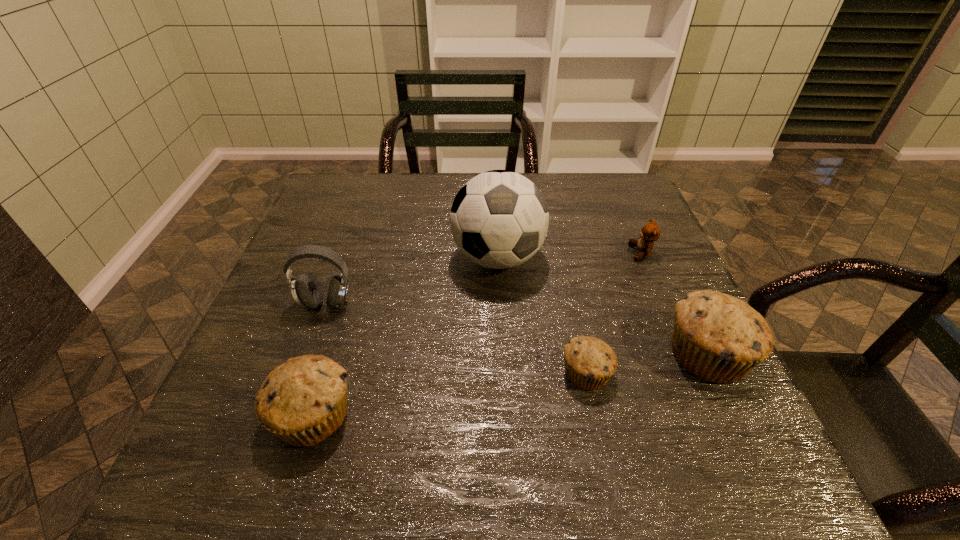
Identify the location of vacant point that satisfies the following two spatial constraints: 1. on the main logo of the rightmost muffin; 2. on the right side of the soccer ball. (502, 354).

I want to click on vacant space that satisfies the following two spatial constraints: 1. on the main logo of the second muffin from right to left; 2. on the right side of the soccer ball, so click(x=503, y=373).

Find the location of a particular element. This screenshot has height=540, width=960. vacant point that satisfies the following two spatial constraints: 1. on the ear cups of the third farthest object; 2. on the right side of the rightmost muffin is located at coordinates 308,354.

You are a GUI agent. You are given a task and a screenshot of the screen. Output one action in this format:
    pyautogui.click(x=<x>, y=<y>)
    Task: Click on the free space that satisfies the following two spatial constraints: 1. on the main logo of the rightmost muffin; 2. on the right side of the soccer ball
    The height and width of the screenshot is (540, 960).
    Given the screenshot: What is the action you would take?
    pyautogui.click(x=502, y=354)

Where is `free space that satisfies the following two spatial constraints: 1. on the front-facing side of the teddy bear; 2. on the front side of the second muffin from left to right`? The height and width of the screenshot is (540, 960). free space that satisfies the following two spatial constraints: 1. on the front-facing side of the teddy bear; 2. on the front side of the second muffin from left to right is located at coordinates (691, 373).

You are a GUI agent. You are given a task and a screenshot of the screen. Output one action in this format:
    pyautogui.click(x=<x>, y=<y>)
    Task: Click on the free location that satisfies the following two spatial constraints: 1. on the front-facing side of the teddy bear; 2. on the ear cups of the headset
    Image resolution: width=960 pixels, height=540 pixels.
    Given the screenshot: What is the action you would take?
    pyautogui.click(x=662, y=303)

Where is `vacant space that satisfies the following two spatial constraints: 1. on the back side of the second muffin from right to left; 2. on the left side of the rightmost muffin`? The width and height of the screenshot is (960, 540). vacant space that satisfies the following two spatial constraints: 1. on the back side of the second muffin from right to left; 2. on the left side of the rightmost muffin is located at coordinates (583, 354).

The width and height of the screenshot is (960, 540). Identify the location of free region that satisfies the following two spatial constraints: 1. on the ear cups of the third shortest object; 2. on the right side of the headset. (287, 415).

Find the location of a particular element. free space that satisfies the following two spatial constraints: 1. on the main logo of the shortest muffin; 2. on the right side of the tallest object is located at coordinates [503, 373].

You are a GUI agent. You are given a task and a screenshot of the screen. Output one action in this format:
    pyautogui.click(x=<x>, y=<y>)
    Task: Click on the vacant space that satisfies the following two spatial constraints: 1. on the back side of the rightmost muffin; 2. on the front-facing side of the teddy bear
    This screenshot has width=960, height=540.
    Given the screenshot: What is the action you would take?
    pyautogui.click(x=661, y=253)